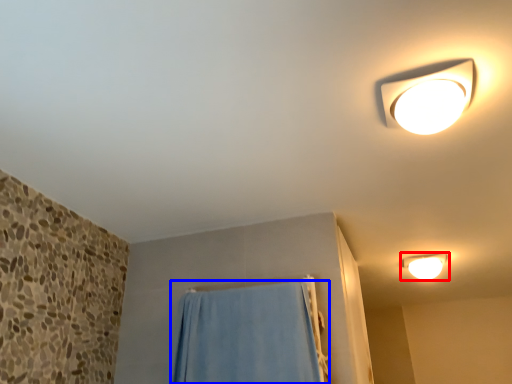
Question: Which point is closer to the camera, lamp (highlighted by a red box) or curtain (highlighted by a blue box)?

Choices:
 (A) lamp
 (B) curtain

Answer: (B)